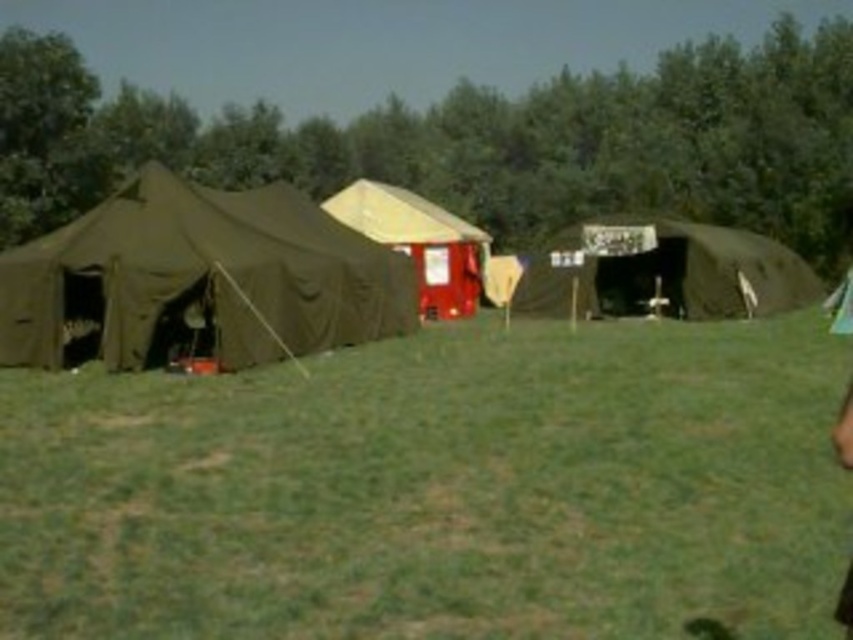
Based on the photo, who is more distant from viewer, [592,496] or [96,244]?

Point [96,244]

Between green grass at center and olive green canvas tent at left, which one is positioned higher?

Positioned higher is olive green canvas tent at left.

The width and height of the screenshot is (853, 640). What do you see at coordinates (438, 488) in the screenshot?
I see `green grass at center` at bounding box center [438, 488].

Locate an element on the screen. The height and width of the screenshot is (640, 853). green grass at center is located at coordinates (438, 488).

Who is shorter, olive green canvas tent at left or matte green tent at center?

Standing shorter between the two is olive green canvas tent at left.

Between point (189, 342) and point (579, 272), which one is positioned in front?

Positioned in front is point (189, 342).

You are a GUI agent. You are given a task and a screenshot of the screen. Output one action in this format:
    pyautogui.click(x=<x>, y=<y>)
    Task: Click on the olive green canvas tent at left
    
    Given the screenshot: What is the action you would take?
    pyautogui.click(x=198, y=280)

Does point (697, 221) come in front of point (392, 204)?

No.

Where is `matte green tent at center`? matte green tent at center is located at coordinates click(666, 273).

The height and width of the screenshot is (640, 853). Identify the location of matte green tent at center. (666, 273).